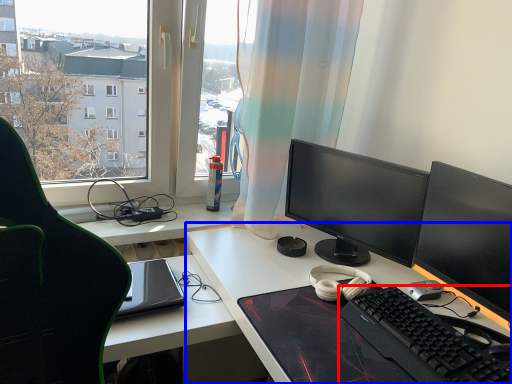
Question: Among these objects, which one is farthest to the camera, computer keyboard (highlighted by a red box) or desk (highlighted by a blue box)?

Choices:
 (A) computer keyboard
 (B) desk

Answer: (A)